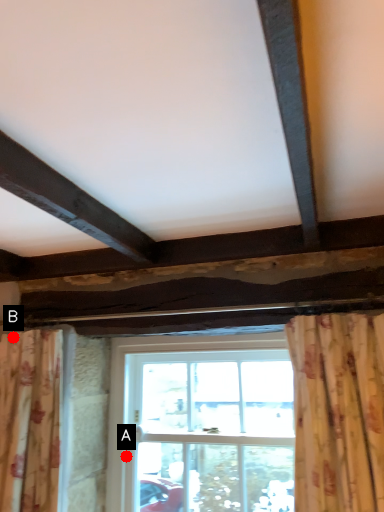
Question: Two points are circled on the image, labeled by A and B beside each circle. Which point is farther to the camera?

Choices:
 (A) A is further
 (B) B is further

Answer: (A)